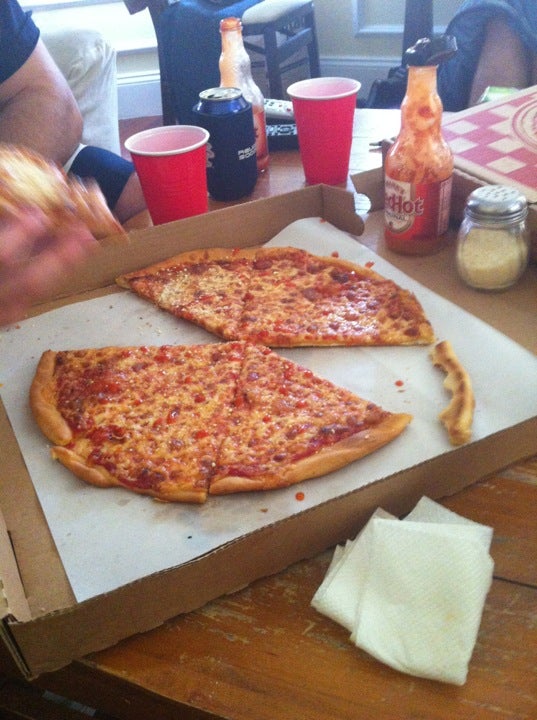
Identify the location of wall. The image size is (537, 720). (344, 35).